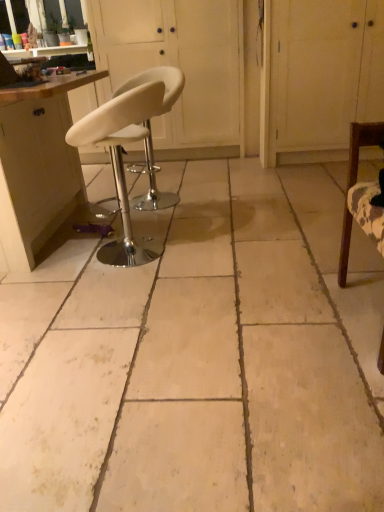
Find the location of a particular element. This screenshot has width=384, height=512. free space between white leather stool at center, the 2th chair when ordered from front to back, and white leather stool at center, which is counted as the 2th chair, starting from the right is located at coordinates (158, 220).